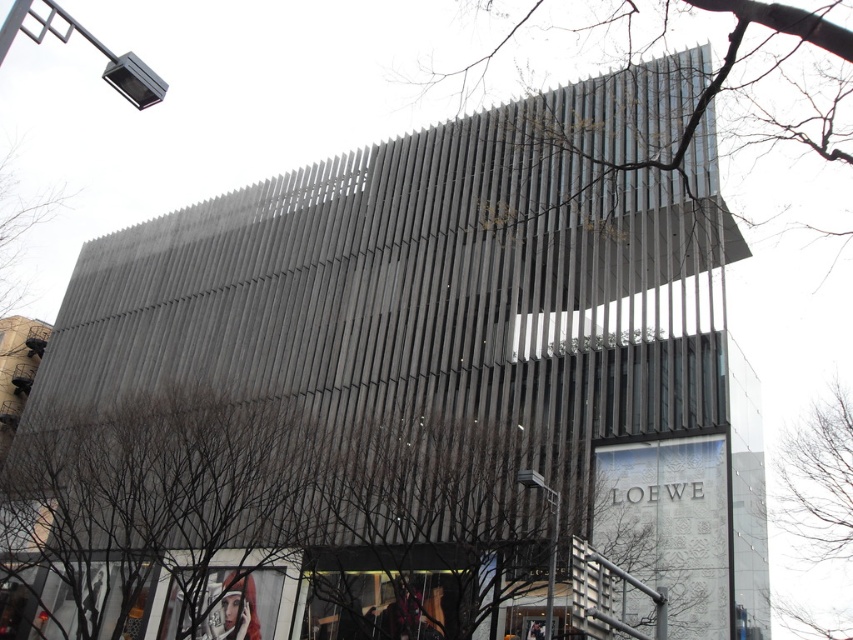
Can you confirm if bare branches at upper center is positioned above bare branches at right?

Indeed, bare branches at upper center is positioned over bare branches at right.

Measure the distance between point (611, 38) and camera.

The distance of point (611, 38) from camera is 261.59 feet.

Where is `bare branches at upper center`? This screenshot has width=853, height=640. bare branches at upper center is located at coordinates (670, 45).

The height and width of the screenshot is (640, 853). What are the coordinates of `bare branches at upper center` in the screenshot? It's located at (670, 45).